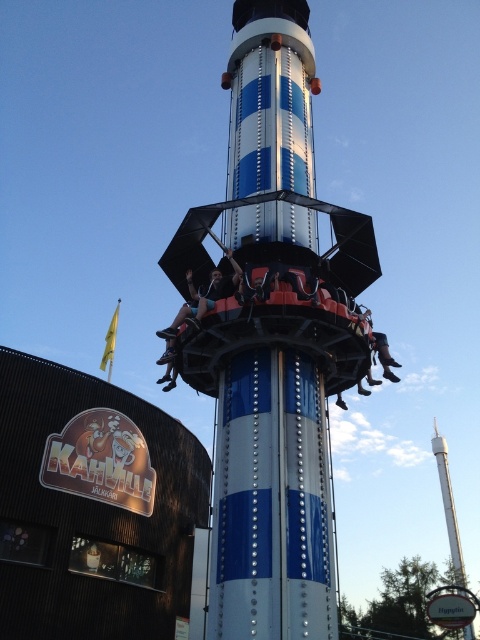
Is the position of blue polished metal pole at center more distant than that of metallic silver helmet at center?

No, blue polished metal pole at center is closer to the viewer.

Does blue polished metal pole at center appear over metallic silver helmet at center?

Incorrect, blue polished metal pole at center is not positioned above metallic silver helmet at center.

Is point (224, 372) positioned in front of point (192, 298)?

Yes, point (224, 372) is closer to viewer.

This screenshot has height=640, width=480. In order to click on blue polished metal pole at center in this screenshot , I will do `click(272, 502)`.

Is blue polished metal pole at center bigger than blue metallic tower at center?

Actually, blue polished metal pole at center might be smaller than blue metallic tower at center.

From the picture: Between blue polished metal pole at center and blue metallic tower at center, which one is positioned lower?

Positioned lower is blue polished metal pole at center.

Who is more forward, (271, 620) or (240, 4)?

Positioned in front is point (271, 620).

The width and height of the screenshot is (480, 640). Find the location of `blue polished metal pole at center`. blue polished metal pole at center is located at coordinates (272, 502).

Which is below, blue polished metal tower at center or blue polished metal pole at center?

blue polished metal pole at center is below.

Can you confirm if blue polished metal tower at center is bigger than blue polished metal pole at center?

Yes.

Is point (291, 416) positioned behind point (218, 493)?

Yes.

Locate an element on the screen. blue polished metal tower at center is located at coordinates (272, 339).